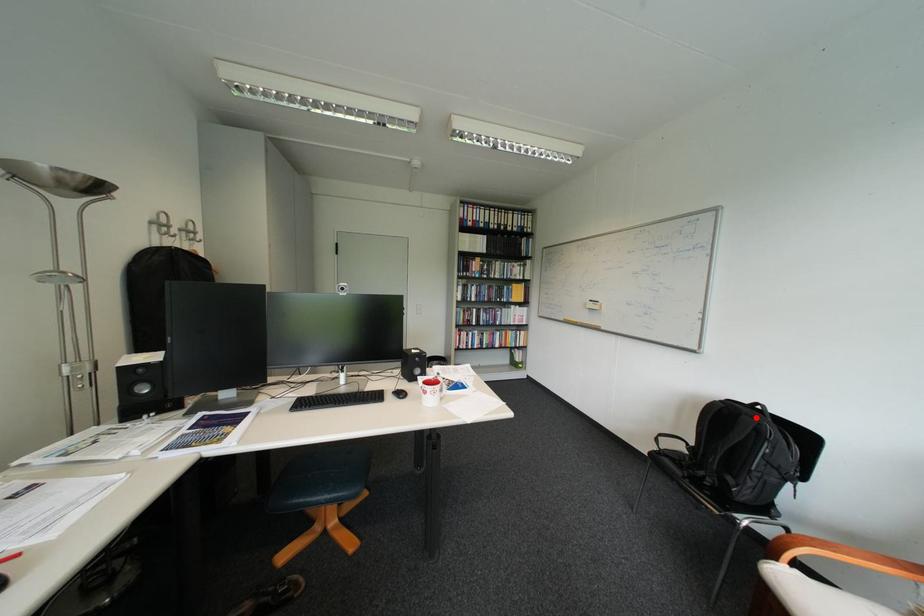
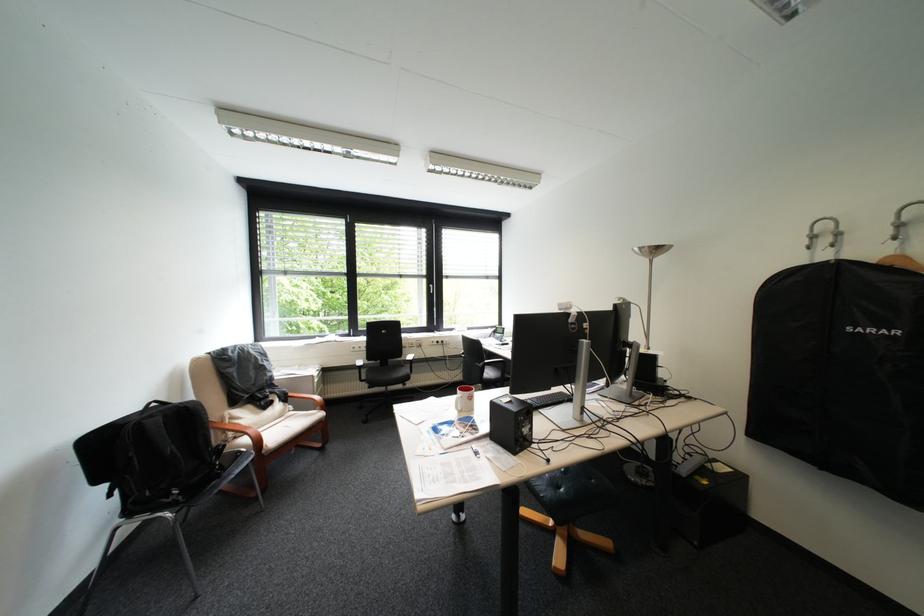
Where in the second image is the point corresponding to the highlighted location from the first image?

(199, 407)